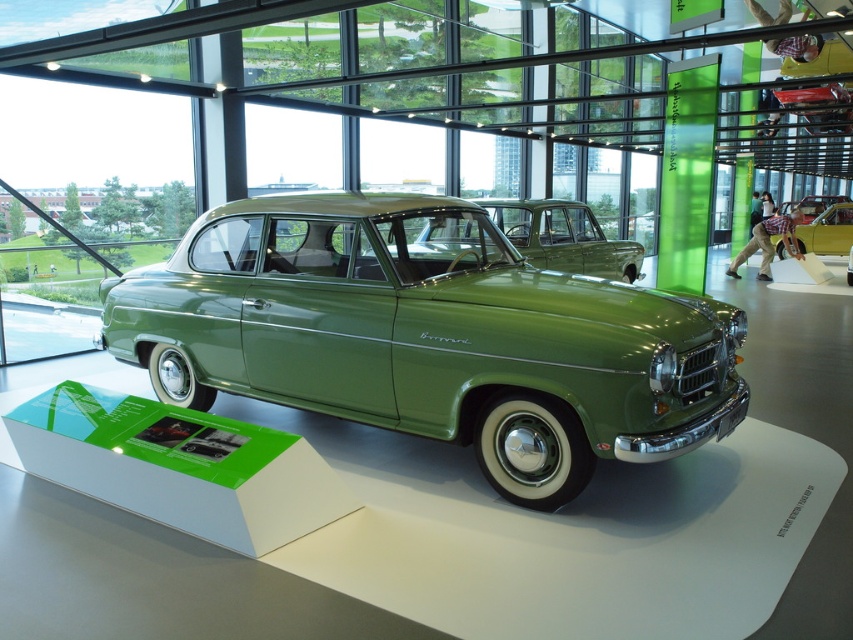
Question: Which point is closer to the camera?

Choices:
 (A) green matte car at center
 (B) metallic gold car at center

Answer: (A)

Question: Can you confirm if green matte car at center is positioned above green matte sedan at center?

Choices:
 (A) no
 (B) yes

Answer: (A)

Question: Does green matte car at center appear over green matte sedan at center?

Choices:
 (A) no
 (B) yes

Answer: (A)

Question: Is green matte sedan at center above metallic gold car at center?

Choices:
 (A) yes
 (B) no

Answer: (B)

Question: Which point is farther to the camera?

Choices:
 (A) green matte car at center
 (B) metallic gold car at center

Answer: (B)

Question: Which object is positioned closest to the green matte sedan at center?

Choices:
 (A) metallic gold car at center
 (B) green matte car at center

Answer: (B)